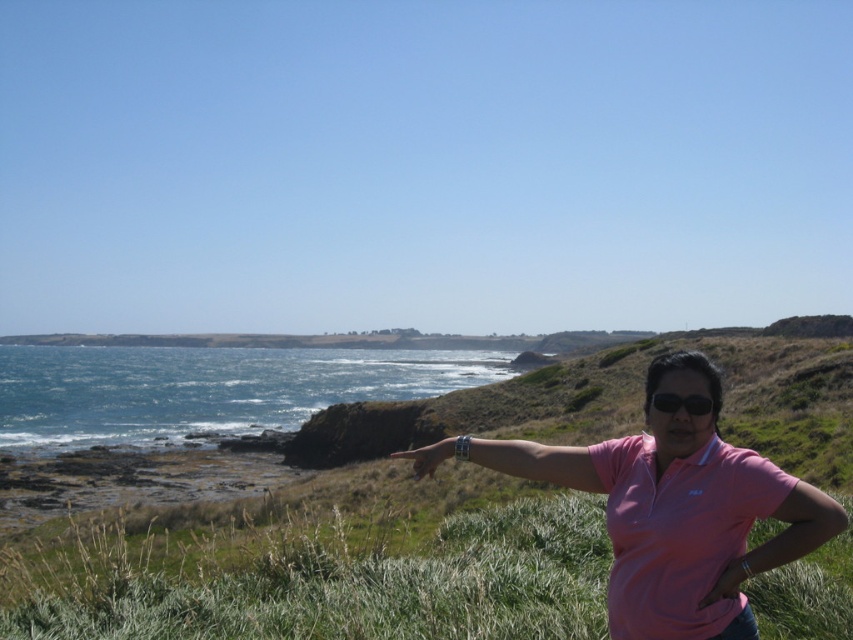
Question: Does pink cotton shirt at center appear on the right side of black matte sunglasses at center?

Choices:
 (A) no
 (B) yes

Answer: (A)

Question: Which object is closer to the camera taking this photo?

Choices:
 (A) pink cotton shirt at center
 (B) black matte sunglasses at center

Answer: (B)

Question: Does pink cotton shirt at center have a greater width compared to black matte sunglasses at center?

Choices:
 (A) no
 (B) yes

Answer: (A)

Question: Considering the real-world distances, which object is closest to the pink cotton shirt at center?

Choices:
 (A) green grassy at lower center
 (B) black matte sunglasses at center

Answer: (B)

Question: Considering the relative positions of green grassy at lower center and black matte sunglasses at center in the image provided, where is green grassy at lower center located with respect to black matte sunglasses at center?

Choices:
 (A) left
 (B) right

Answer: (A)

Question: Which object appears closest to the camera in this image?

Choices:
 (A) black matte sunglasses at center
 (B) pink cotton shirt at center
 (C) green grassy at lower center

Answer: (A)